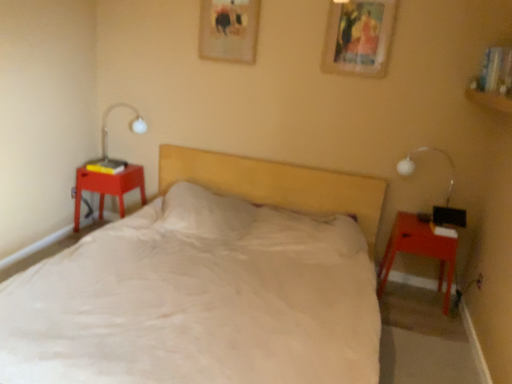
Question: Is white glass bedside lamp at right not close to matte red nightstand at right, arranged as the 1th nightstand when viewed from the front?

Choices:
 (A) no
 (B) yes

Answer: (A)

Question: Could you tell me if white glass bedside lamp at right is turned towards matte red nightstand at right, the first nightstand when ordered from right to left?

Choices:
 (A) yes
 (B) no

Answer: (B)

Question: Is white glass bedside lamp at right at the right side of matte red nightstand at right, which is counted as the 2th nightstand, starting from the back?

Choices:
 (A) no
 (B) yes

Answer: (B)

Question: Is white glass bedside lamp at right looking in the opposite direction of matte red nightstand at right, arranged as the 1th nightstand when viewed from the front?

Choices:
 (A) yes
 (B) no

Answer: (B)

Question: Is white glass bedside lamp at right further to the viewer compared to matte red nightstand at right, marked as the 2th nightstand in a left-to-right arrangement?

Choices:
 (A) no
 (B) yes

Answer: (B)

Question: Is wooden picture frame at upper center, which is the first picture frame in left-to-right order, to the left or to the right of matte red nightstand at right, arranged as the 1th nightstand when viewed from the front, in the image?

Choices:
 (A) right
 (B) left

Answer: (B)

Question: Choose the correct answer: Is wooden picture frame at upper center, which is the first picture frame in left-to-right order, inside matte red nightstand at right, the first nightstand when ordered from right to left, or outside it?

Choices:
 (A) inside
 (B) outside

Answer: (B)

Question: In the image, is wooden picture frame at upper center, the first picture frame when ordered from back to front, positioned in front of or behind matte red nightstand at right, which is counted as the 2th nightstand, starting from the back?

Choices:
 (A) front
 (B) behind

Answer: (B)

Question: Is point (234, 44) closer or farther from the camera than point (448, 264)?

Choices:
 (A) closer
 (B) farther

Answer: (B)

Question: Is point (346, 203) positioned closer to the camera than point (446, 203)?

Choices:
 (A) closer
 (B) farther

Answer: (B)

Question: From their relative heights in the image, would you say white soft bed at center is taller or shorter than white glass bedside lamp at right?

Choices:
 (A) tall
 (B) short

Answer: (A)

Question: From a real-world perspective, is white soft bed at center above or below white glass bedside lamp at right?

Choices:
 (A) below
 (B) above

Answer: (A)

Question: From the image's perspective, is white soft bed at center above or below white glass bedside lamp at right?

Choices:
 (A) above
 (B) below

Answer: (B)

Question: Considering the relative positions of matte plastic nightstand at left, which is the second nightstand from front to back, and matte red nightstand at right, the first nightstand when ordered from right to left, in the image provided, is matte plastic nightstand at left, which is the second nightstand from front to back, to the left or to the right of matte red nightstand at right, the first nightstand when ordered from right to left,?

Choices:
 (A) right
 (B) left

Answer: (B)

Question: From a real-world perspective, is matte plastic nightstand at left, which is the second nightstand from front to back, above or below matte red nightstand at right, arranged as the 1th nightstand when viewed from the front?

Choices:
 (A) below
 (B) above

Answer: (B)